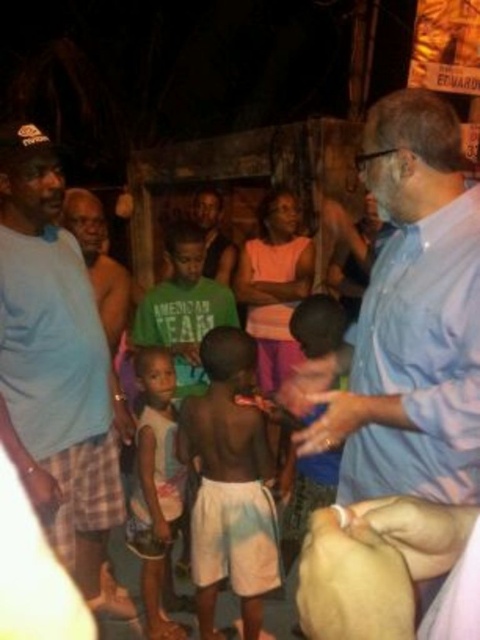
Can you confirm if white cotton shirt at center is positioned to the right of green t-shirt at center?

No, white cotton shirt at center is not to the right of green t-shirt at center.

Who is shorter, white cotton shirt at center or green t-shirt at center?

green t-shirt at center is shorter.

Who is more distant from viewer, (179,500) or (207,237)?

Point (207,237)

At what (x,y) coordinates should I click in order to perform the action: click on white cotton shirt at center. Please return your answer as a coordinate pair (x, y). Looking at the image, I should click on 156,488.

Is point (25, 372) positioned behind point (151, 477)?

No.

Can you confirm if light blue t-shirt at left is positioned below white cotton shirt at center?

No.

Is point (17, 131) closer to camera compared to point (152, 492)?

Yes, point (17, 131) is in front of point (152, 492).

I want to click on light blue t-shirt at left, so click(59, 365).

Does light skin smooth skin at center have a greater height compared to white cotton shirt at center?

Yes.

Does point (249, 556) come farther from viewer compared to point (166, 628)?

No, it is not.

Locate an element on the screen. The image size is (480, 640). light skin smooth skin at center is located at coordinates (229, 484).